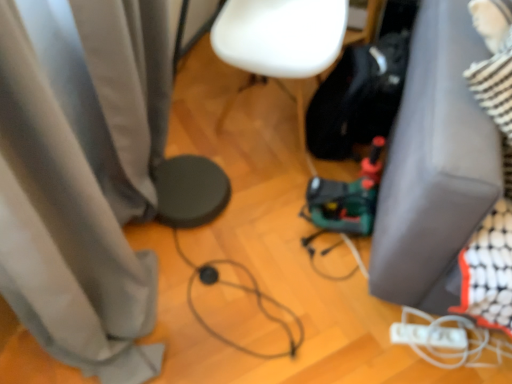
You are a GUI agent. You are given a task and a screenshot of the screen. Output one action in this format:
    pyautogui.click(x=<x>, y=<y>)
    Task: Click on the vacant space in front of white matte wii controller at lower right
    This screenshot has height=384, width=512.
    Given the screenshot: What is the action you would take?
    pyautogui.click(x=428, y=368)